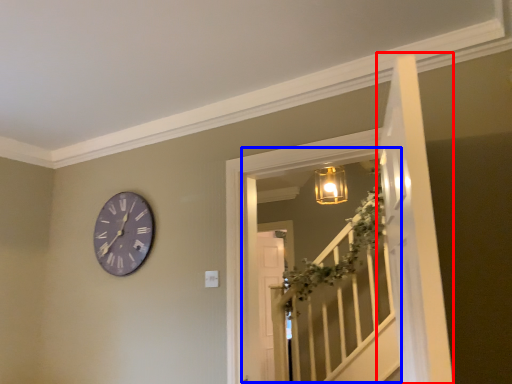
Question: Which of the following is the closest to the observer, door (highlighted by a red box) or window (highlighted by a blue box)?

Choices:
 (A) door
 (B) window

Answer: (A)